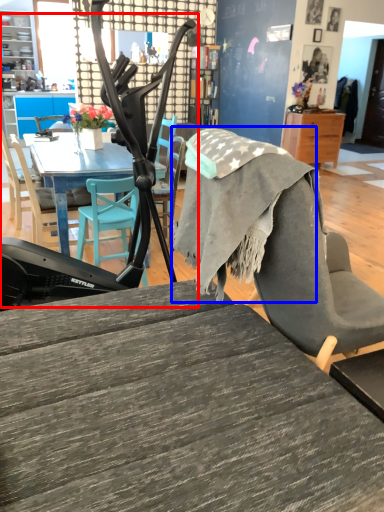
Question: Among these objects, which one is farthest to the camera, baby carriage (highlighted by a red box) or fabric (highlighted by a blue box)?

Choices:
 (A) baby carriage
 (B) fabric

Answer: (A)